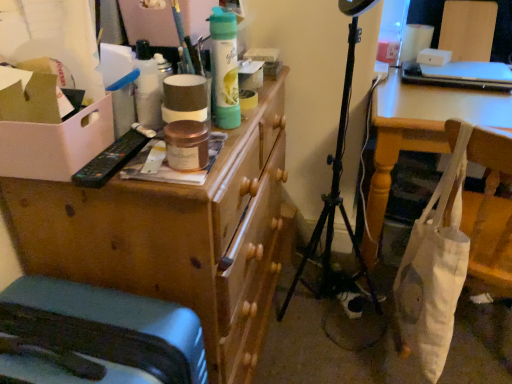
Based on the photo, measure the distance between point (426, 354) and camera.

Point (426, 354) is 1.13 meters from camera.

This screenshot has height=384, width=512. In order to click on white canvas tote at lower right in this screenshot , I will do `click(434, 273)`.

Identify the location of white fabric bag at lower right. (420, 133).

Locate an element on the screen. wooden chest of drawers at upper left is located at coordinates (175, 236).

Can you confirm if white cardboard box at left is smaller than white fabric bag at lower right?

Correct, white cardboard box at left occupies less space than white fabric bag at lower right.

From a real-world perspective, is white cardboard box at left positioned above or below white fabric bag at lower right?

Clearly, from a real-world perspective, white cardboard box at left is above white fabric bag at lower right.

Is white cardboard box at left far away from white fabric bag at lower right?

They are positioned close to each other.

Could you tell me if white cardboard box at left is turned towards white fabric bag at lower right?

No, white cardboard box at left is not turned towards white fabric bag at lower right.

Does white cardboard box at left turn towards white canvas tote at lower right?

No, white cardboard box at left does not turn towards white canvas tote at lower right.

Is white cardboard box at left far away from white canvas tote at lower right?

No, white cardboard box at left is not far away from white canvas tote at lower right.

Is white cardboard box at left located outside white canvas tote at lower right?

Yes, white cardboard box at left is located beyond the bounds of white canvas tote at lower right.

Considering the relative sizes of white cardboard box at left and white canvas tote at lower right in the image provided, is white cardboard box at left smaller than white canvas tote at lower right?

Indeed, white cardboard box at left has a smaller size compared to white canvas tote at lower right.

From the image's perspective, is white cardboard box at left positioned above or below matte gray suitcase at lower left?

white cardboard box at left is situated higher than matte gray suitcase at lower left in the image.

Could you tell me if white cardboard box at left is facing matte gray suitcase at lower left?

No, white cardboard box at left does not turn towards matte gray suitcase at lower left.

Locate an element on the screen. This screenshot has width=512, height=384. cardboard box on the left of the matte gray suitcase at lower left is located at coordinates (55, 144).

How many degrees apart are the facing directions of white canvas tote at lower right and white cardboard box at left?

They differ by 164 degrees in their facing directions.

From a real-world perspective, is white canvas tote at lower right located beneath white cardboard box at left?

Indeed, from a real-world perspective, white canvas tote at lower right is positioned beneath white cardboard box at left.

Is point (407, 277) closer or farther from the camera than point (31, 154)?

Point (407, 277) appears to be farther away from the viewer than point (31, 154).

Does wooden chest of drawers at upper left appear on the right side of matte gray suitcase at lower left?

Yes.

Is wooden chest of drawers at upper left completely or partially outside of matte gray suitcase at lower left?

wooden chest of drawers at upper left is positioned outside matte gray suitcase at lower left.

Considering the sizes of objects wooden chest of drawers at upper left and matte gray suitcase at lower left in the image provided, who is taller, wooden chest of drawers at upper left or matte gray suitcase at lower left?

wooden chest of drawers at upper left is taller.

Which is correct: white fabric bag at lower right is inside wooden chest of drawers at upper left, or outside of it?

white fabric bag at lower right is not enclosed by wooden chest of drawers at upper left.

Looking at their sizes, would you say white fabric bag at lower right is wider or thinner than wooden chest of drawers at upper left?

Considering their sizes, white fabric bag at lower right looks broader than wooden chest of drawers at upper left.

Is white fabric bag at lower right facing away from wooden chest of drawers at upper left?

No, white fabric bag at lower right is not facing the opposite direction of wooden chest of drawers at upper left.

Can you confirm if white fabric bag at lower right is taller than wooden chest of drawers at upper left?

No, white fabric bag at lower right is not taller than wooden chest of drawers at upper left.

From a real-world perspective, is white fabric bag at lower right above or below matte gray suitcase at lower left?

white fabric bag at lower right is below matte gray suitcase at lower left.

Considering the sizes of objects white fabric bag at lower right and matte gray suitcase at lower left in the image provided, who is smaller, white fabric bag at lower right or matte gray suitcase at lower left?

matte gray suitcase at lower left is smaller.

Is white fabric bag at lower right positioned with its back to matte gray suitcase at lower left?

That's not correct — white fabric bag at lower right is not looking away from matte gray suitcase at lower left.

Find the location of a particular element. table that appears behind the white cardboard box at left is located at coordinates (420, 133).

What are the coordinates of `bag that appears below the white cardboard box at left (from the image's perspective)` in the screenshot? It's located at (434, 273).

Looking at the image, which one is located closer to white canvas tote at lower right, white fabric bag at lower right or wooden chest of drawers at upper left?

white fabric bag at lower right is closer to white canvas tote at lower right.

Looking at the image, which one is located closer to white cardboard box at left, matte gray suitcase at lower left or white fabric bag at lower right?

matte gray suitcase at lower left is positioned closer to the anchor white cardboard box at left.

In the scene shown: When comparing their distances from white fabric bag at lower right, does matte gray suitcase at lower left or wooden chest of drawers at upper left seem further?

matte gray suitcase at lower left is further to white fabric bag at lower right.

Looking at the image, which one is located further to matte gray suitcase at lower left, white canvas tote at lower right or white cardboard box at left?

white canvas tote at lower right lies further to matte gray suitcase at lower left than the other object.

Based on their spatial positions, is matte gray suitcase at lower left or wooden chest of drawers at upper left further from white canvas tote at lower right?

Among the two, matte gray suitcase at lower left is located further to white canvas tote at lower right.

Based on their spatial positions, is white cardboard box at left or white fabric bag at lower right closer to white canvas tote at lower right?

white fabric bag at lower right lies closer to white canvas tote at lower right than the other object.

Estimate the real-world distances between objects in this image. Which object is further from white fabric bag at lower right, wooden chest of drawers at upper left or matte gray suitcase at lower left?

matte gray suitcase at lower left.

From the picture: Estimate the real-world distances between objects in this image. Which object is closer to white fabric bag at lower right, white canvas tote at lower right or wooden chest of drawers at upper left?

white canvas tote at lower right is positioned closer to the anchor white fabric bag at lower right.

The image size is (512, 384). Identify the location of desk located between white cardboard box at left and white canvas tote at lower right in the left-right direction. (175, 236).

The image size is (512, 384). I want to click on desk between matte gray suitcase at lower left and white fabric bag at lower right from left to right, so click(x=175, y=236).

Image resolution: width=512 pixels, height=384 pixels. I want to click on furniture located between white cardboard box at left and white fabric bag at lower right in the left-right direction, so click(101, 334).

Identify the location of bag between wooden chest of drawers at upper left and white fabric bag at lower right from left to right. This screenshot has height=384, width=512. (434, 273).